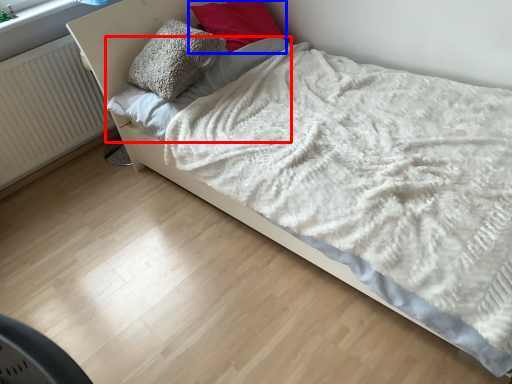
Question: Which object is further to the camera taking this photo, sheet (highlighted by a red box) or pillow (highlighted by a blue box)?

Choices:
 (A) sheet
 (B) pillow

Answer: (B)